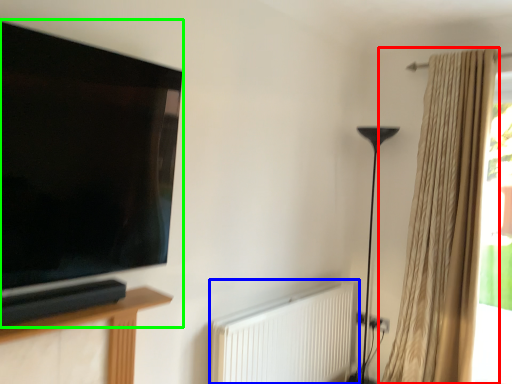
Question: Which object is positioned closest to curtain (highlighted by a red box)? Select from radiator (highlighted by a blue box) and television (highlighted by a green box).

Choices:
 (A) radiator
 (B) television

Answer: (A)